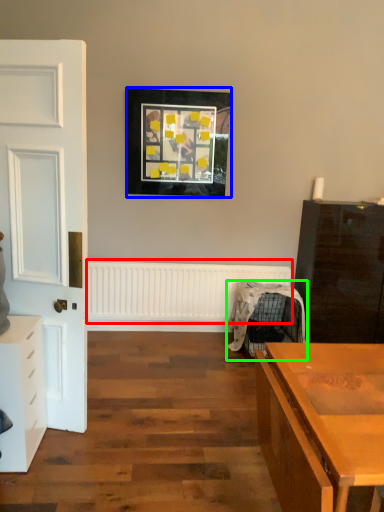
Question: Based on their relative distances, which object is farther from radiator (highlighted by a red box)? Choose from picture frame (highlighted by a blue box) and swivel chair (highlighted by a green box).

Choices:
 (A) picture frame
 (B) swivel chair

Answer: (A)